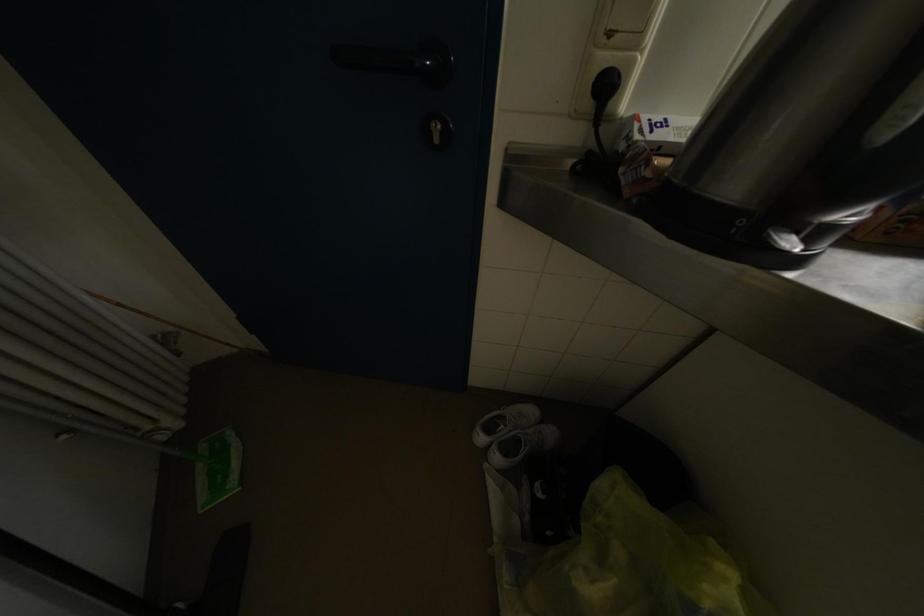
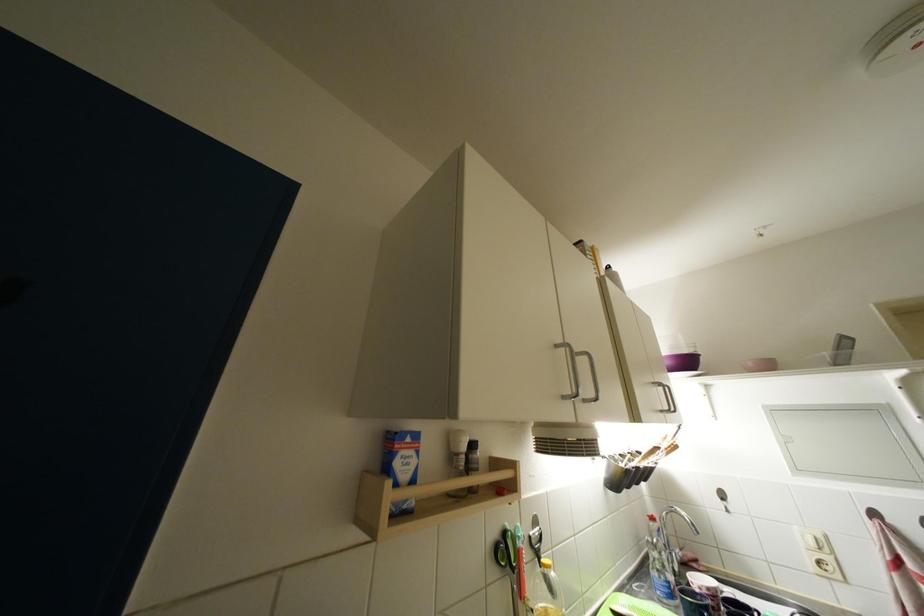
How did the camera likely rotate?

The camera's rotation is toward right-up.